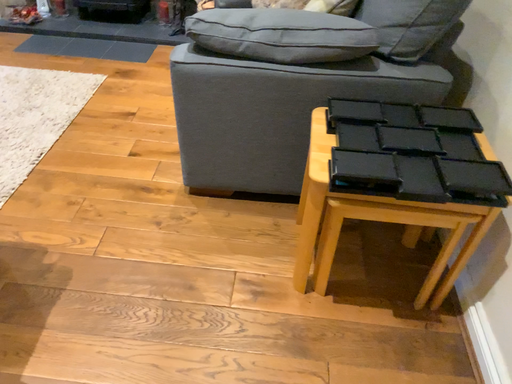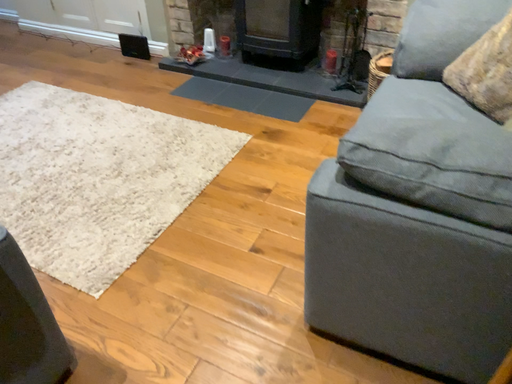
Question: How did the camera likely rotate when shooting the video?

Choices:
 (A) rotated left
 (B) rotated right

Answer: (A)